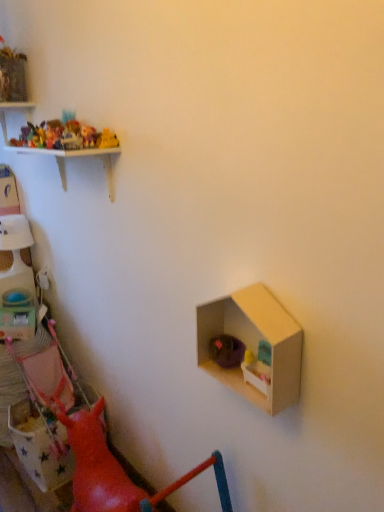
Question: Would you say matte cardboard dollhouse at center right is outside purple fabric basket at lower right, the first toy from the front?

Choices:
 (A) no
 (B) yes

Answer: (B)

Question: Considering the relative sizes of matte cardboard dollhouse at center right and purple fabric basket at lower right, the first toy from the front, in the image provided, is matte cardboard dollhouse at center right shorter than purple fabric basket at lower right, the first toy from the front,?

Choices:
 (A) yes
 (B) no

Answer: (B)

Question: Is purple fabric basket at lower right, the 4th toy in the top-to-bottom sequence, at the back of matte cardboard dollhouse at center right?

Choices:
 (A) no
 (B) yes

Answer: (B)

Question: From a real-world perspective, is matte cardboard dollhouse at center right positioned under purple fabric basket at lower right, the 4th toy in the top-to-bottom sequence, based on gravity?

Choices:
 (A) yes
 (B) no

Answer: (B)

Question: From a real-world perspective, is matte cardboard dollhouse at center right on purple fabric basket at lower right, marked as the 4th toy in a back-to-front arrangement?

Choices:
 (A) no
 (B) yes

Answer: (B)

Question: Is point (51, 133) closer or farther from the camera than point (215, 351)?

Choices:
 (A) farther
 (B) closer

Answer: (A)

Question: Is plastic toys at upper left, the fourth toy positioned from the right, in front of or behind purple fabric basket at lower right, the 4th toy in the top-to-bottom sequence, in the image?

Choices:
 (A) front
 (B) behind

Answer: (B)

Question: Would you say plastic toys at upper left, arranged as the 1th toy when viewed from the left, is inside or outside purple fabric basket at lower right, the 4th toy in the top-to-bottom sequence?

Choices:
 (A) inside
 (B) outside

Answer: (B)

Question: Is plastic toys at upper left, arranged as the 3th toy when ordered from the bottom, wider or thinner than purple fabric basket at lower right, which is the 1th toy from bottom to top?

Choices:
 (A) thin
 (B) wide

Answer: (A)

Question: Is matte plastic toy box at left taller or shorter than plastic toys at upper left, the third toy when ordered from front to back?

Choices:
 (A) tall
 (B) short

Answer: (A)

Question: Is matte plastic toy box at left inside or outside of plastic toys at upper left, which appears as the 2th toy when viewed from the back?

Choices:
 (A) inside
 (B) outside

Answer: (B)

Question: Looking at the image, does matte plastic toy box at left seem bigger or smaller compared to plastic toys at upper left, the fourth toy positioned from the right?

Choices:
 (A) big
 (B) small

Answer: (A)

Question: Is point (23, 308) closer or farther from the camera than point (59, 134)?

Choices:
 (A) farther
 (B) closer

Answer: (A)

Question: Considering the positions of point (94, 137) and point (79, 132), is point (94, 137) closer or farther from the camera than point (79, 132)?

Choices:
 (A) farther
 (B) closer

Answer: (B)

Question: Would you say plastic toy car at upper left, the second toy positioned from the front, is inside or outside plastic toys at upper left, which is the 2th toy in left-to-right order?

Choices:
 (A) inside
 (B) outside

Answer: (B)